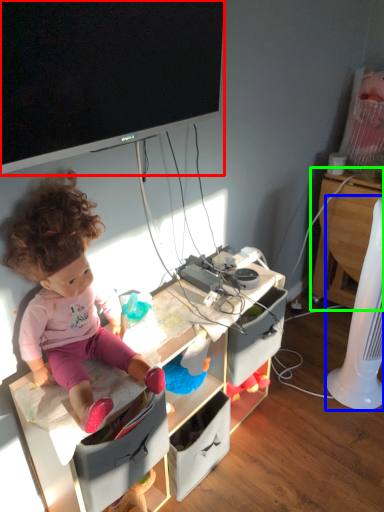
Question: Which is nearer to the television (highlighted by a red box)? fan (highlighted by a blue box) or computer desk (highlighted by a green box).

Choices:
 (A) fan
 (B) computer desk

Answer: (A)